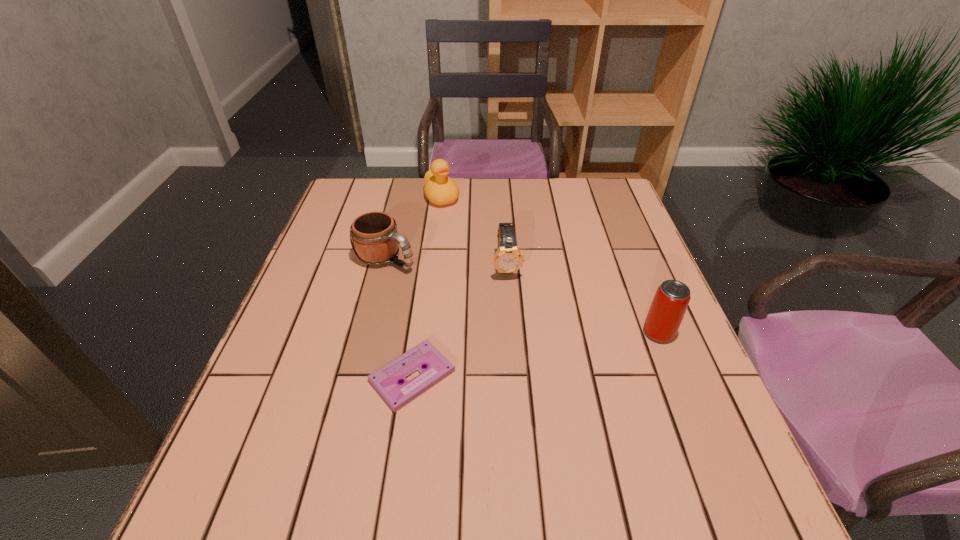
The image size is (960, 540). In order to click on vacant area located on the face of the fourth object from left to right in this screenshot , I will do `click(526, 376)`.

Find the location of a particular element. vacant space located on the face of the fourth object from left to right is located at coordinates (527, 380).

This screenshot has height=540, width=960. In order to click on vacant area located 0.130m on the face of the fourth object from left to right in this screenshot , I will do `click(516, 321)`.

The width and height of the screenshot is (960, 540). Identify the location of vacant area situated on the face of the farthest object. (464, 234).

Find the location of a particular element. The height and width of the screenshot is (540, 960). vacant space located 0.070m on the face of the farthest object is located at coordinates (455, 221).

Where is `vacant area situated 0.190m on the face of the farthest object`? This screenshot has width=960, height=540. vacant area situated 0.190m on the face of the farthest object is located at coordinates [x=470, y=244].

Image resolution: width=960 pixels, height=540 pixels. Identify the location of object that is at the far edge. click(439, 189).

Locate an element on the screen. The height and width of the screenshot is (540, 960). object that is at the left edge is located at coordinates (375, 240).

Identify the location of object that is at the right edge. This screenshot has width=960, height=540. (672, 297).

You are a GUI agent. You are given a task and a screenshot of the screen. Output one action in this format:
    pyautogui.click(x=<x>, y=<y>)
    Task: Click on the vacant region at the far edge
    The width and height of the screenshot is (960, 540).
    Given the screenshot: What is the action you would take?
    pyautogui.click(x=451, y=206)